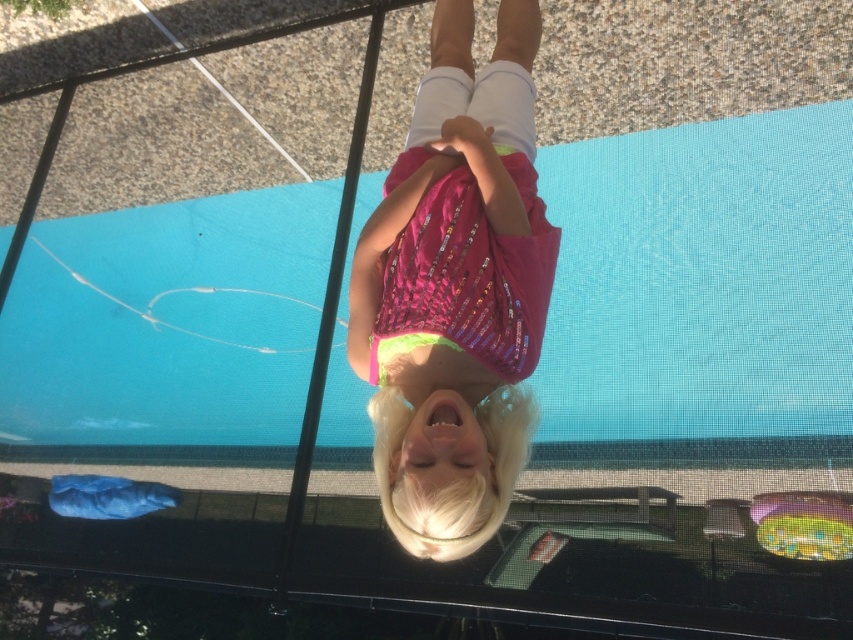
Does point (303, 380) come farther from viewer compared to point (427, 305)?

Yes, point (303, 380) is farther from viewer.

In the scene shown: Between blue rubber mat at center and pink sequined shirt at center, which one has more height?

blue rubber mat at center is taller.

Who is more distant from viewer, (305,189) or (432,477)?

Positioned behind is point (305,189).

The width and height of the screenshot is (853, 640). Identify the location of blue rubber mat at center. (701, 285).